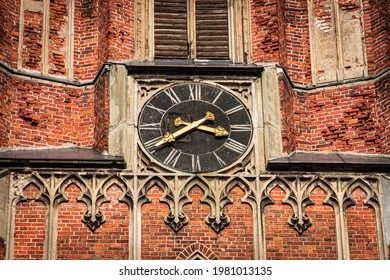
The height and width of the screenshot is (280, 390). In order to click on clock in this screenshot , I will do `click(192, 118)`.